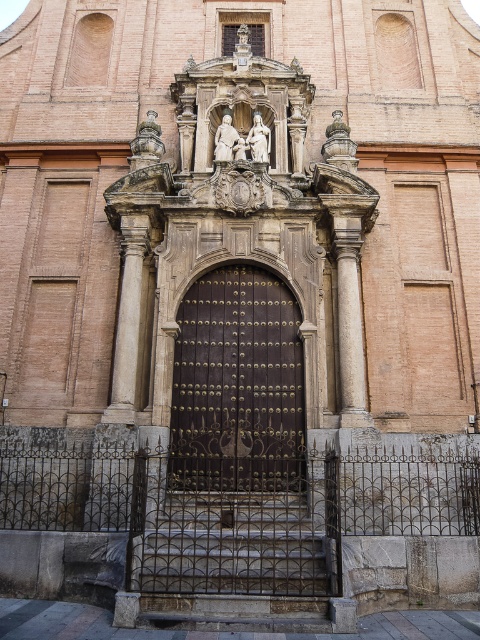
You are standing at the entrance of the historic building and want to touch both the dark brown wrought iron gate at center and the white marble statue at center. Which one can you reach first without moving your position?

You can reach the dark brown wrought iron gate at center first because it is closer to you than the white marble statue at center.